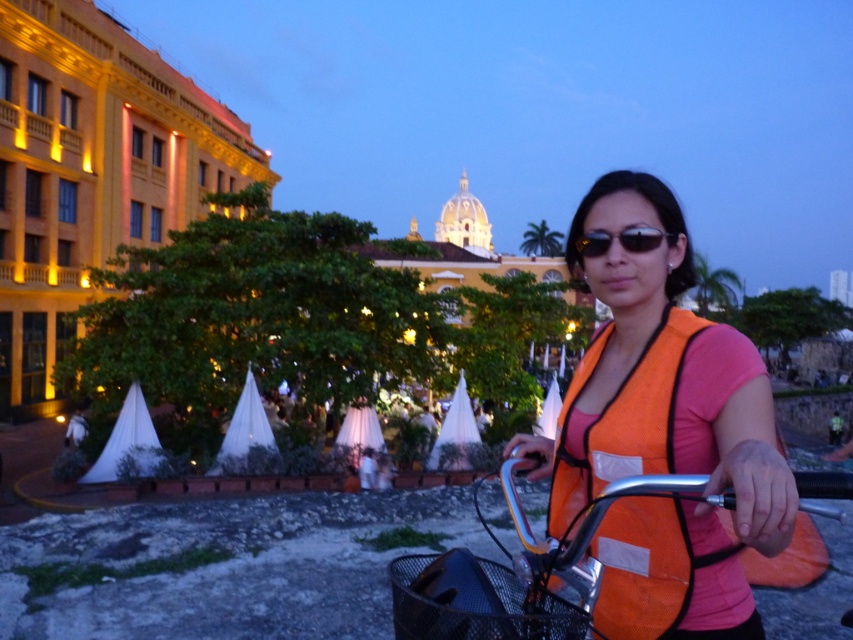
Question: Is orange mesh vest at center further to the viewer compared to black reflective sunglasses at center?

Choices:
 (A) no
 (B) yes

Answer: (A)

Question: Which object is positioned farthest from the metallic silver bicycle at center?

Choices:
 (A) black reflective sunglasses at center
 (B) black mesh basket at center
 (C) orange mesh vest at center

Answer: (A)

Question: Is orange mesh vest at center smaller than metallic silver bicycle at center?

Choices:
 (A) yes
 (B) no

Answer: (A)

Question: Which object is positioned closest to the black mesh basket at center?

Choices:
 (A) black reflective sunglasses at center
 (B) orange mesh vest at center
 (C) metallic silver bicycle at center

Answer: (C)

Question: Which point is closer to the camera taking this photo?

Choices:
 (A) (625, 234)
 (B) (434, 618)

Answer: (B)

Question: From the image, what is the correct spatial relationship of metallic silver bicycle at center in relation to black mesh basket at center?

Choices:
 (A) right
 (B) left

Answer: (A)